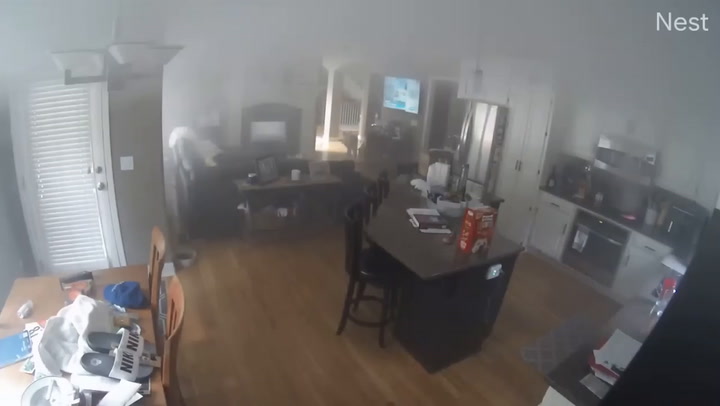
The width and height of the screenshot is (720, 406). I want to click on tv, so click(x=410, y=106).